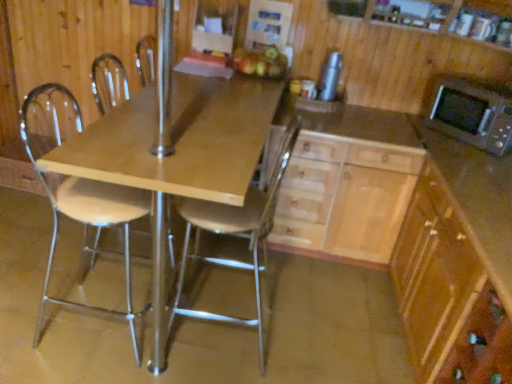
Locate an element on the screen. The height and width of the screenshot is (384, 512). unoccupied space behind white plastic chair at left, arranged as the first chair when viewed from the left is located at coordinates (124, 265).